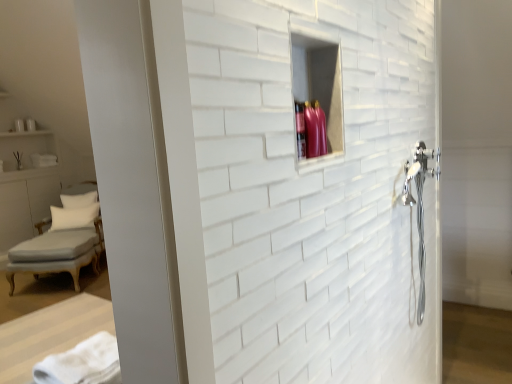
What do you see at coordinates (83, 363) in the screenshot?
I see `white soft towel at lower left` at bounding box center [83, 363].

What do you see at coordinates (78, 200) in the screenshot?
I see `white fabric pillow at left, which is the 2th pillow from front to back` at bounding box center [78, 200].

You are a GUI agent. You are given a task and a screenshot of the screen. Output one action in this format:
    pyautogui.click(x=<x>, y=<y>)
    Task: Click on the white soft pillow at left, which is the 1th pillow in front-to-back order
    
    Given the screenshot: What is the action you would take?
    (73, 217)

Which object is wider, light gray fabric chaise at lower left or white fabric pillow at left, which is the 2th pillow from front to back?

light gray fabric chaise at lower left.

Which point is more distant from viewer, (34, 246) or (78, 205)?

Positioned behind is point (78, 205).

There is a light gray fabric chaise at lower left. Identify the location of the 2nd pillow above it (from a real-world perspective). The image size is (512, 384). (78, 200).

Who is taller, white soft pillow at left, which is the 1th pillow in front-to-back order, or white soft towel at lower left?

white soft pillow at left, which is the 1th pillow in front-to-back order.

From a real-world perspective, is white soft pillow at left, which is the second pillow from back to front, positioned over white soft towel at lower left based on gravity?

Actually, white soft pillow at left, which is the second pillow from back to front, is physically below white soft towel at lower left in the real world.

In the image, is white soft pillow at left, which is the 1th pillow in front-to-back order, positioned in front of or behind white fabric pillow at left, which is the first pillow in back-to-front order?

white soft pillow at left, which is the 1th pillow in front-to-back order, is in front of white fabric pillow at left, which is the first pillow in back-to-front order.

From a real-world perspective, which is physically below, white soft pillow at left, which is the 1th pillow in front-to-back order, or white fabric pillow at left, which is the first pillow in back-to-front order?

white soft pillow at left, which is the 1th pillow in front-to-back order, is physically lower.

Considering the relative sizes of white soft pillow at left, which is the 1th pillow in front-to-back order, and white fabric pillow at left, which is the first pillow in back-to-front order, in the image provided, is white soft pillow at left, which is the 1th pillow in front-to-back order, bigger than white fabric pillow at left, which is the first pillow in back-to-front order,?

Correct, white soft pillow at left, which is the 1th pillow in front-to-back order, is larger in size than white fabric pillow at left, which is the first pillow in back-to-front order.

Identify the location of pillow on the left of white soft pillow at left, which is the second pillow from back to front. (78, 200).

Who is taller, light gray fabric chaise at lower left or white soft towel at lower left?

light gray fabric chaise at lower left is taller.

Can you tell me how much light gray fabric chaise at lower left and white soft towel at lower left differ in facing direction?

122 degrees separate the facing orientations of light gray fabric chaise at lower left and white soft towel at lower left.

From the image's perspective, is light gray fabric chaise at lower left beneath white soft towel at lower left?

Yes, from the image's perspective, light gray fabric chaise at lower left is beneath white soft towel at lower left.

Can white soft towel at lower left be found inside light gray fabric chaise at lower left?

No, white soft towel at lower left is not surrounded by light gray fabric chaise at lower left.

Does white soft towel at lower left have a greater height compared to white soft pillow at left, which is the 1th pillow in front-to-back order?

No.

From the image's perspective, between white soft towel at lower left and white soft pillow at left, which is the second pillow from back to front, who is located below?

white soft towel at lower left.

Is there a large distance between white soft towel at lower left and white soft pillow at left, which is the second pillow from back to front?

Yes, white soft towel at lower left is far from white soft pillow at left, which is the second pillow from back to front.

Between point (94, 339) and point (93, 207), which one is positioned behind?

The point (93, 207) is behind.

Is light gray fabric chaise at lower left at the left side of white soft pillow at left, which is the second pillow from back to front?

In fact, light gray fabric chaise at lower left is to the right of white soft pillow at left, which is the second pillow from back to front.

Is light gray fabric chaise at lower left taller or shorter than white soft pillow at left, which is the 1th pillow in front-to-back order?

light gray fabric chaise at lower left is taller than white soft pillow at left, which is the 1th pillow in front-to-back order.

You are a GUI agent. You are given a task and a screenshot of the screen. Output one action in this format:
    pyautogui.click(x=<x>, y=<y>)
    Task: Click on the 1st pillow above the light gray fabric chaise at lower left (from the image's perspective)
    The width and height of the screenshot is (512, 384).
    Given the screenshot: What is the action you would take?
    tap(73, 217)

Does point (49, 250) come behind point (65, 221)?

That is False.

Are white soft towel at lower left and white fabric pillow at left, which is the first pillow in back-to-front order, far apart?

That's right, there is a large distance between white soft towel at lower left and white fabric pillow at left, which is the first pillow in back-to-front order.

Between white soft towel at lower left and white fabric pillow at left, which is the first pillow in back-to-front order, which one has more height?

white fabric pillow at left, which is the first pillow in back-to-front order, is taller.

You are a GUI agent. You are given a task and a screenshot of the screen. Output one action in this format:
    pyautogui.click(x=<x>, y=<y>)
    Task: Click on the bath towel that appears below the white fabric pillow at left, which is the 2th pillow from front to back (from the image's perspective)
    
    Given the screenshot: What is the action you would take?
    pyautogui.click(x=83, y=363)

Which of these two, white soft towel at lower left or white fabric pillow at left, which is the first pillow in back-to-front order, is bigger?

With larger size is white fabric pillow at left, which is the first pillow in back-to-front order.

This screenshot has height=384, width=512. What are the coordinates of `chair below the white fabric pillow at left, which is the 2th pillow from front to back (from a real-world perspective)` in the screenshot? It's located at (62, 241).

Find the location of a particular element. The image size is (512, 384). pillow that is the 1st one when counting leftward from the white soft towel at lower left is located at coordinates (73, 217).

Which object lies further to the anchor point white soft towel at lower left, white fabric pillow at left, which is the 2th pillow from front to back, or light gray fabric chaise at lower left?

white fabric pillow at left, which is the 2th pillow from front to back.

When comparing their distances from light gray fabric chaise at lower left, does white soft pillow at left, which is the second pillow from back to front, or white fabric pillow at left, which is the 2th pillow from front to back, seem closer?

white soft pillow at left, which is the second pillow from back to front.

Which object lies further to the anchor point light gray fabric chaise at lower left, white soft pillow at left, which is the 1th pillow in front-to-back order, or white soft towel at lower left?

Among the two, white soft towel at lower left is located further to light gray fabric chaise at lower left.

Considering their positions, is white fabric pillow at left, which is the first pillow in back-to-front order, positioned closer to white soft pillow at left, which is the second pillow from back to front, than white soft towel at lower left?

white fabric pillow at left, which is the first pillow in back-to-front order, is closer to white soft pillow at left, which is the second pillow from back to front.

From the image, which object appears to be farther from white soft towel at lower left, white soft pillow at left, which is the 1th pillow in front-to-back order, or light gray fabric chaise at lower left?

white soft pillow at left, which is the 1th pillow in front-to-back order, is further to white soft towel at lower left.

Estimate the real-world distances between objects in this image. Which object is closer to white fabric pillow at left, which is the first pillow in back-to-front order, white soft towel at lower left or light gray fabric chaise at lower left?

light gray fabric chaise at lower left is positioned closer to the anchor white fabric pillow at left, which is the first pillow in back-to-front order.

Looking at the image, which one is located further to white soft towel at lower left, white soft pillow at left, which is the 1th pillow in front-to-back order, or white fabric pillow at left, which is the first pillow in back-to-front order?

white fabric pillow at left, which is the first pillow in back-to-front order.

Which object lies nearer to the anchor point white soft pillow at left, which is the second pillow from back to front, white soft towel at lower left or white fabric pillow at left, which is the 2th pillow from front to back?

white fabric pillow at left, which is the 2th pillow from front to back, is positioned closer to the anchor white soft pillow at left, which is the second pillow from back to front.

Locate an element on the screen. The height and width of the screenshot is (384, 512). chair positioned between white soft towel at lower left and white soft pillow at left, which is the second pillow from back to front, from near to far is located at coordinates (62, 241).

This screenshot has width=512, height=384. Identify the location of pillow located between light gray fabric chaise at lower left and white fabric pillow at left, which is the 2th pillow from front to back, in the depth direction. (73, 217).

Locate an element on the screen. Image resolution: width=512 pixels, height=384 pixels. pillow located between white soft towel at lower left and white fabric pillow at left, which is the first pillow in back-to-front order, in the depth direction is located at coordinates (73, 217).

Identify the location of chair between white soft towel at lower left and white fabric pillow at left, which is the first pillow in back-to-front order, along the z-axis. The height and width of the screenshot is (384, 512). (62, 241).